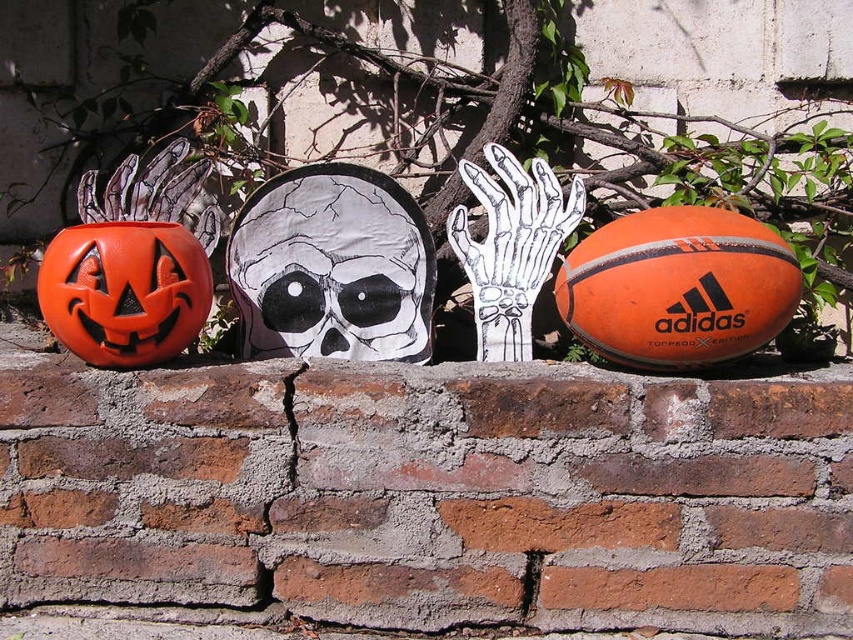
You are a delivery person who needs to place a new orange rubber basketball at right and an orange matte pumpkin at left on a weathered brick wall. The minimum required distance between them is 30 inches for safety. Can you confirm if the current placement meets the safety requirement?

The orange rubber basketball at right and orange matte pumpkin at left are 32.14 inches apart from each other, which exceeds the 30 inches minimum requirement. Therefore, the current placement meets the safety requirement.

Consider the image. You are standing in front of a weathered brick wall with Halloween decorations. You see a carved pumpkin with a jack o lantern face on the left and a black paper skull at center. Which object is closer to the center of the wall?

The black paper skull at center is exactly at the center of the wall, so it is closer to the center than the carved pumpkin with a jack o lantern face on the left.